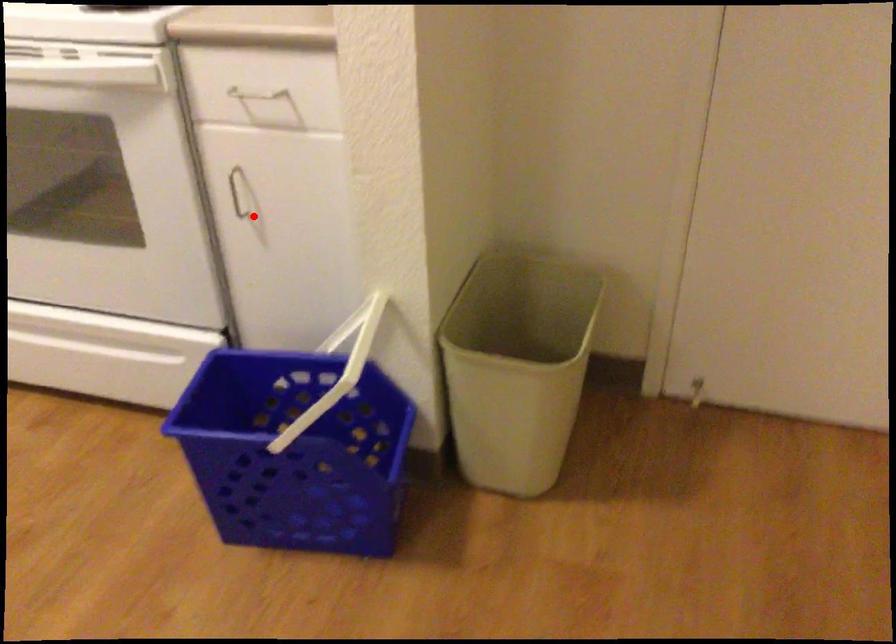
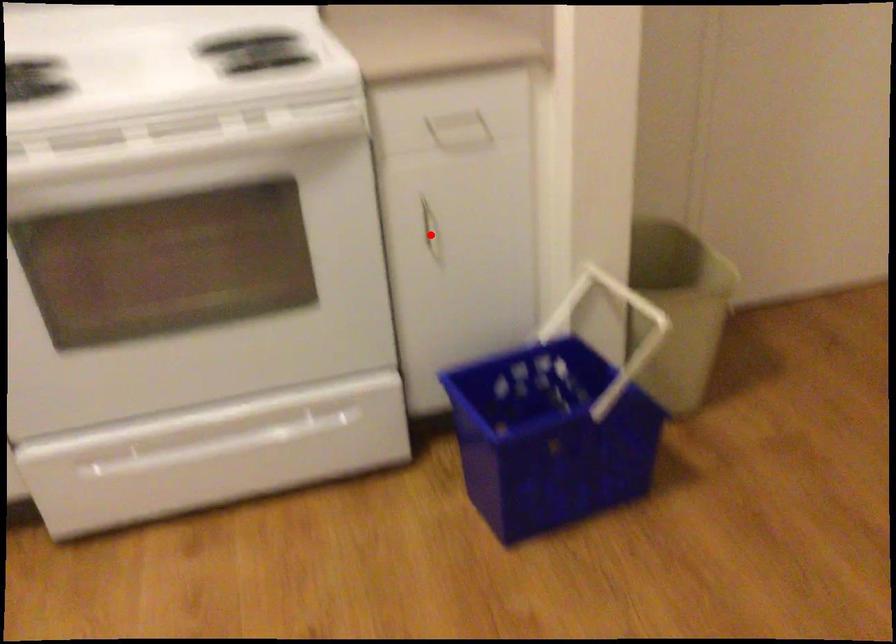
Consider the image. I am providing you with two images of the same scene from different viewpoints. A red point is marked on the first image and another point is marked on the second image. Is the marked point in image1 the same physical position as the marked point in image2?

Yes